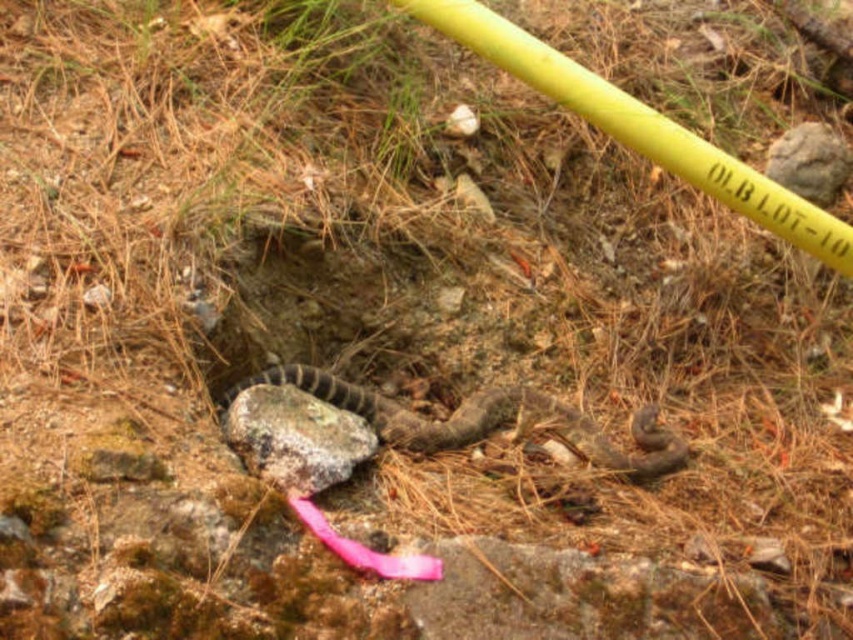
Question: Does gray rough rock at center appear over gray rough rock at upper right?

Choices:
 (A) yes
 (B) no

Answer: (B)

Question: Which point is farther to the camera?

Choices:
 (A) (815, 154)
 (B) (309, 440)

Answer: (A)

Question: In this image, where is gray rough rock at center located relative to gray rough rock at upper right?

Choices:
 (A) above
 (B) below

Answer: (B)

Question: Is gray rough rock at center further to the viewer compared to gray rough rock at upper right?

Choices:
 (A) yes
 (B) no

Answer: (B)

Question: Which point is farther to the camera?

Choices:
 (A) (811, 157)
 (B) (302, 481)

Answer: (A)